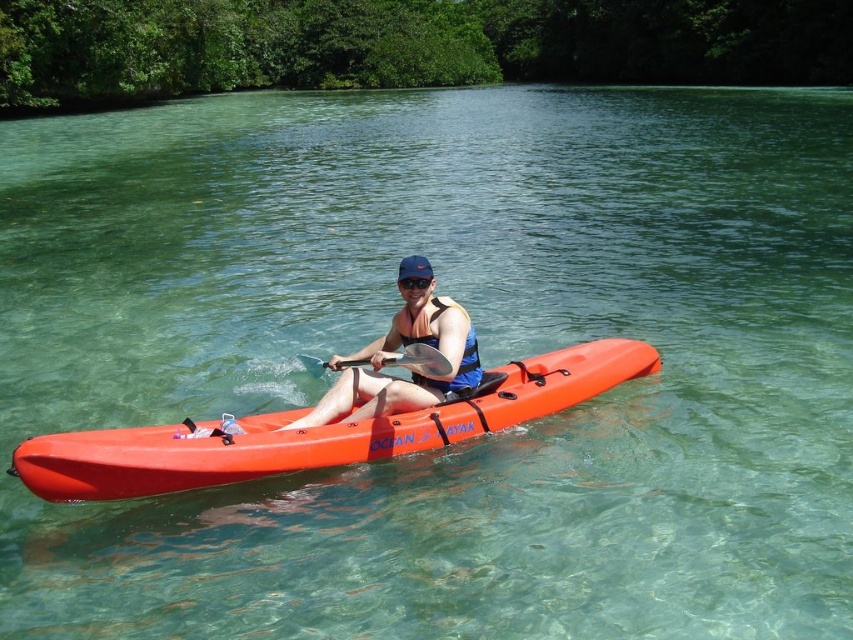
Question: Where is blue fabric life jacket at center located in relation to wooden paddle at center in the image?

Choices:
 (A) left
 (B) right

Answer: (B)

Question: Which point is closer to the camera?

Choices:
 (A) (408, 353)
 (B) (465, 372)

Answer: (A)

Question: Which point appears farthest from the camera in this image?

Choices:
 (A) (405, 288)
 (B) (347, 365)
 (C) (331, 392)

Answer: (B)

Question: In this image, where is wooden paddle at center located relative to transparent plastic goggles at center?

Choices:
 (A) below
 (B) above

Answer: (A)

Question: Is matte blue life vest at center to the left of blue fabric life jacket at center from the viewer's perspective?

Choices:
 (A) no
 (B) yes

Answer: (B)

Question: Which point appears closest to the camera in this image?

Choices:
 (A) (109, 483)
 (B) (468, 364)
 (C) (412, 280)
 (D) (410, 364)

Answer: (A)